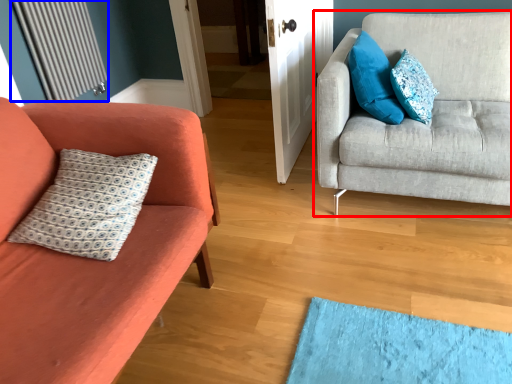
Question: Which object appears closest to the camera in this image, studio couch (highlighted by a red box) or radiator (highlighted by a blue box)?

Choices:
 (A) studio couch
 (B) radiator

Answer: (A)